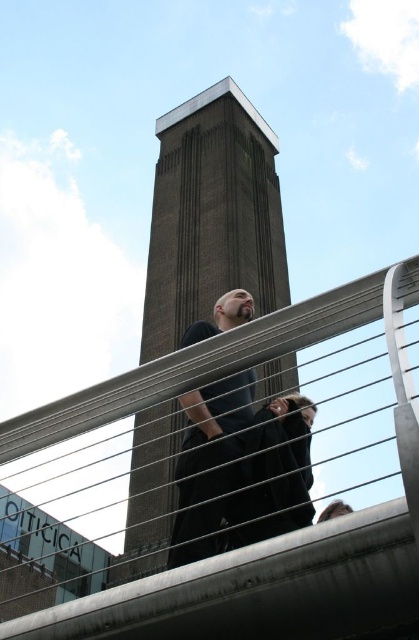
You are standing on the metallic gray pedestrian bridge at center and want to take a photo of the brown brick tower at center. Which object is between you and the tower?

The metallic gray pedestrian bridge at center is between you and the brown brick tower at center because it is closer to the viewer.

You are standing on a bridge and want to take a photo of the brown brick tower at center and the dark blue shirt at center. Which object is closer to you?

The dark blue shirt at center is closer to you because the brown brick tower at center is further away.

You are standing on a bridge and see the brown brick tower at center and the dark blue shirt at center. Which object takes up more space in the image?

The brown brick tower at center is larger in size than the dark blue shirt at center, so it takes up more space in the image.